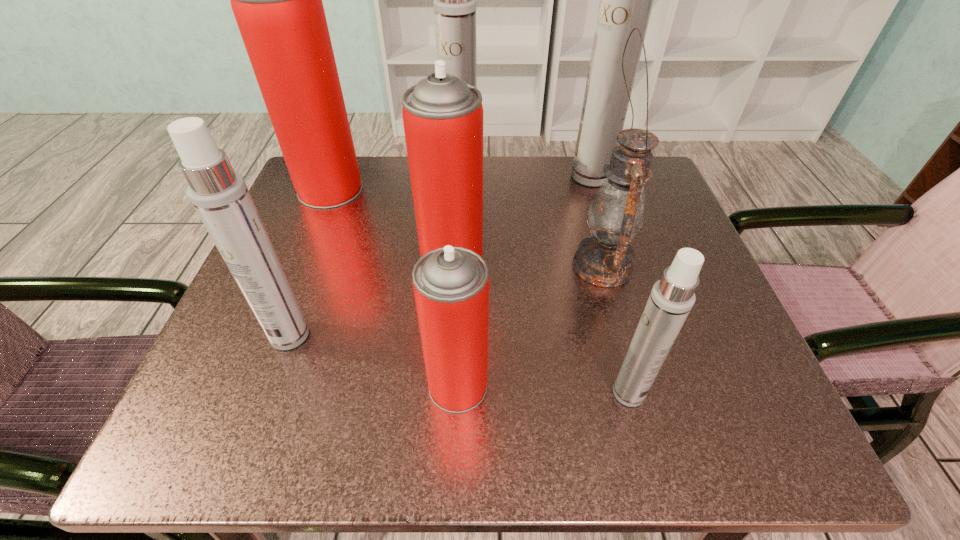
The width and height of the screenshot is (960, 540). Identify the location of the nearest red aerosol can. (451, 284).

In order to click on the smallest white aerosol can in this screenshot , I will do `click(672, 298)`.

This screenshot has height=540, width=960. Find the location of `vacant space situated on the front of the tallest aerosol can`. vacant space situated on the front of the tallest aerosol can is located at coordinates (609, 234).

Locate an element on the screen. The image size is (960, 540). vacant region located on the front of the third white aerosol can from right to left is located at coordinates (455, 284).

Find the location of a particular element. This screenshot has height=540, width=960. free space located 0.370m on the front of the farthest red aerosol can is located at coordinates (263, 356).

Image resolution: width=960 pixels, height=540 pixels. What are the coordinates of `free spot located on the left of the oil lamp` in the screenshot? It's located at (443, 266).

Identify the location of blank area located on the back of the leftmost white aerosol can. The width and height of the screenshot is (960, 540). (310, 281).

Locate an element on the screen. free region located 0.060m on the front of the fourth farthest aerosol can is located at coordinates (449, 310).

This screenshot has height=540, width=960. Identify the location of free point located 0.170m on the back of the nearest red aerosol can. (462, 280).

The height and width of the screenshot is (540, 960). Identify the location of free point located 0.270m on the back of the smallest white aerosol can. (592, 254).